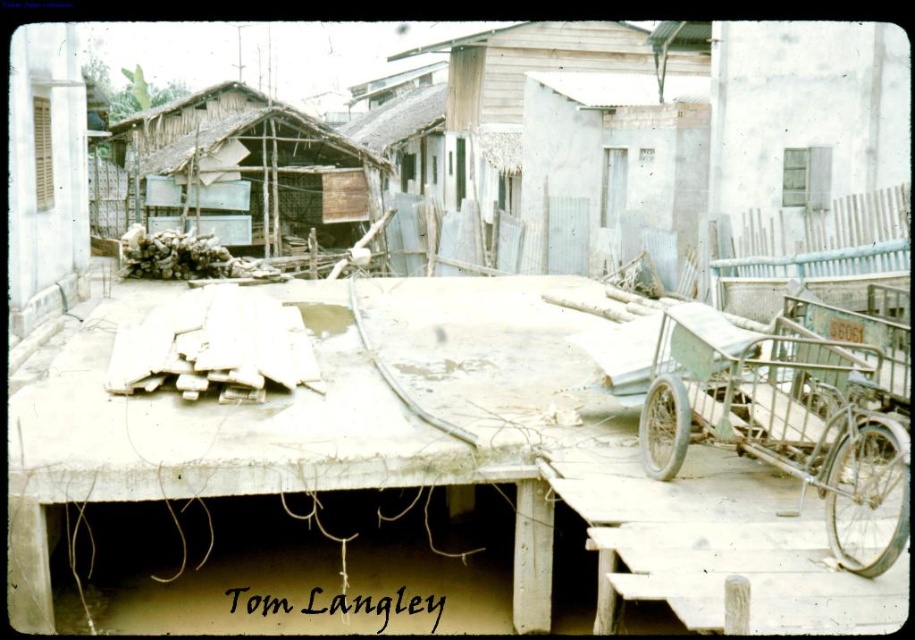
Question: In this image, where is green metallic wagon at right located relative to wooden planks at center?

Choices:
 (A) left
 (B) right

Answer: (B)

Question: Is green metallic wagon at right wider than wooden planks at center?

Choices:
 (A) yes
 (B) no

Answer: (B)

Question: Is green metallic wagon at right further to camera compared to wooden planks at center?

Choices:
 (A) yes
 (B) no

Answer: (B)

Question: Among these points, which one is farthest from the camera?

Choices:
 (A) (367, 163)
 (B) (663, 413)

Answer: (A)